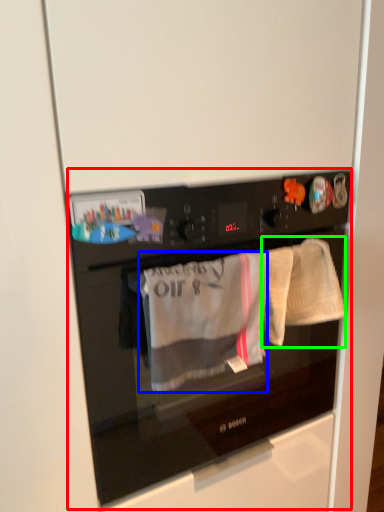
Question: Which object is the closest to the home appliance (highlighted by a red box)? Choose among these: clothing (highlighted by a blue box) or baby clothe (highlighted by a green box).

Choices:
 (A) clothing
 (B) baby clothe

Answer: (A)